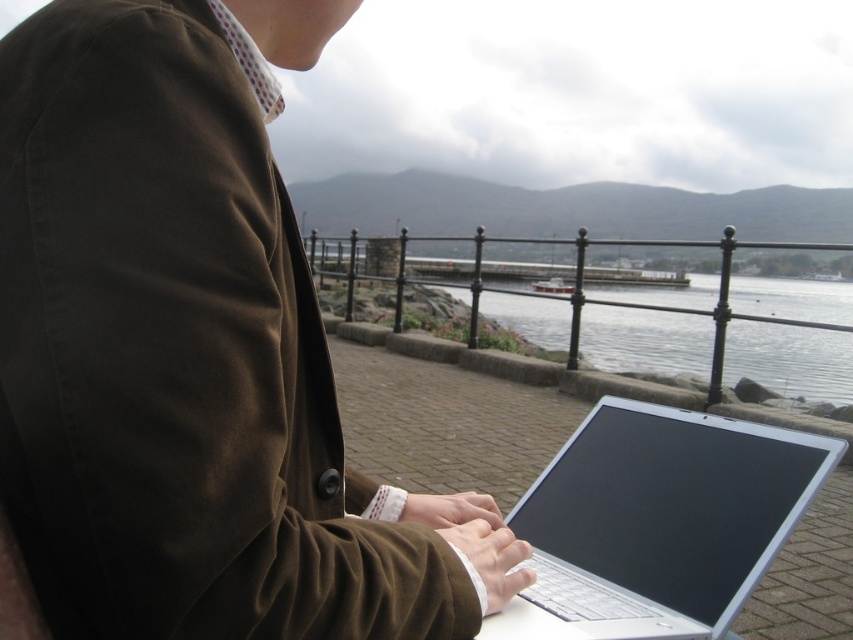
Which is below, brown cotton jacket at center or silver metallic laptop at center?

silver metallic laptop at center

At what (x,y) coordinates should I click in order to perform the action: click on brown cotton jacket at center. Please return your answer as a coordinate pair (x, y). Image resolution: width=853 pixels, height=640 pixels. Looking at the image, I should click on (192, 352).

The width and height of the screenshot is (853, 640). What are the coordinates of `brown cotton jacket at center` in the screenshot? It's located at point(192,352).

Does silver metallic laptop at center appear over clear water at center?

Correct, silver metallic laptop at center is located above clear water at center.

Which of these two, silver metallic laptop at center or clear water at center, stands shorter?

Standing shorter between the two is silver metallic laptop at center.

This screenshot has width=853, height=640. What are the coordinates of `silver metallic laptop at center` in the screenshot? It's located at (657, 524).

In the scene shown: Does brown cotton jacket at center come in front of clear water at center?

Yes, brown cotton jacket at center is closer to the viewer.

Image resolution: width=853 pixels, height=640 pixels. Identify the location of brown cotton jacket at center. (192, 352).

Which is behind, point (114, 472) or point (567, 324)?

Point (567, 324)

The width and height of the screenshot is (853, 640). Identify the location of brown cotton jacket at center. (192, 352).